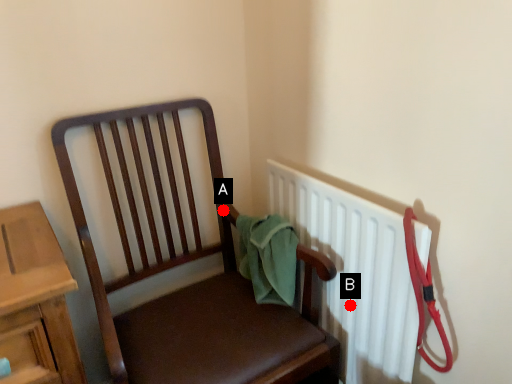
Question: Two points are circled on the image, labeled by A and B beside each circle. Which point is farther from the camera taking this photo?

Choices:
 (A) A is further
 (B) B is further

Answer: (A)